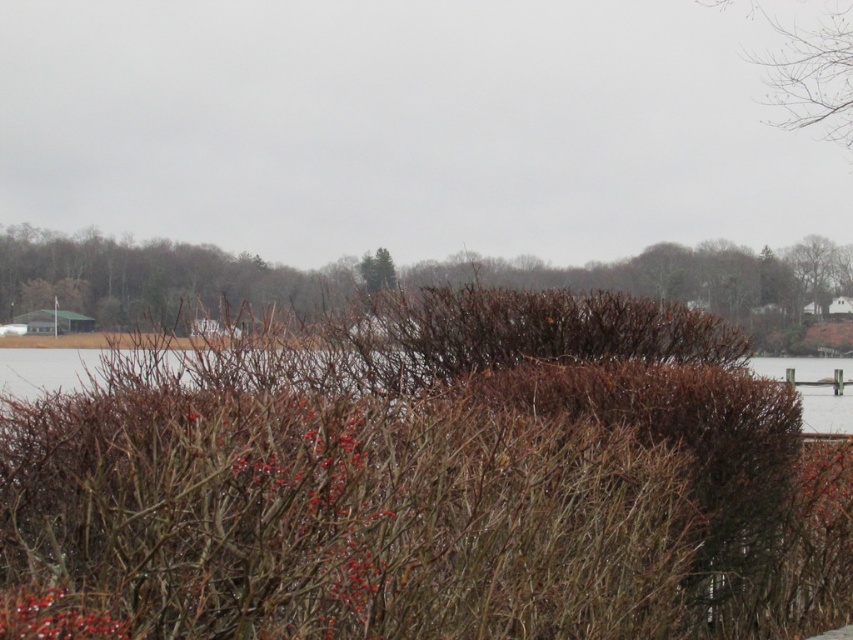
Question: Does brown textured bush at left appear under bare branches at upper right?

Choices:
 (A) yes
 (B) no

Answer: (A)

Question: Which object is closer to the camera taking this photo?

Choices:
 (A) brown textured water at center
 (B) brown textured bush at left
 (C) bare branches at upper right

Answer: (A)

Question: Which of the following is the closest to the observer?

Choices:
 (A) (494, 268)
 (B) (772, 368)
 (C) (838, 45)

Answer: (C)

Question: Can you confirm if brown textured bush at left is positioned above bare branches at upper right?

Choices:
 (A) no
 (B) yes

Answer: (A)

Question: Which point is closer to the camera taking this photo?

Choices:
 (A) [x=30, y=381]
 (B) [x=851, y=97]

Answer: (A)

Question: Does brown textured bush at left come in front of brown textured water at center?

Choices:
 (A) no
 (B) yes

Answer: (A)